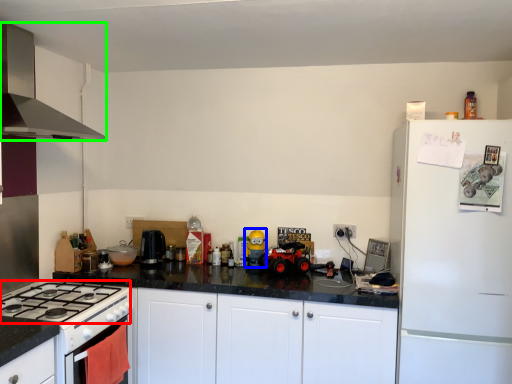
Question: Based on their relative distances, which object is nearer to gas stove (highlighted by a red box)? Choose from toy (highlighted by a blue box) and kitchen appliance (highlighted by a green box).

Choices:
 (A) toy
 (B) kitchen appliance

Answer: (B)